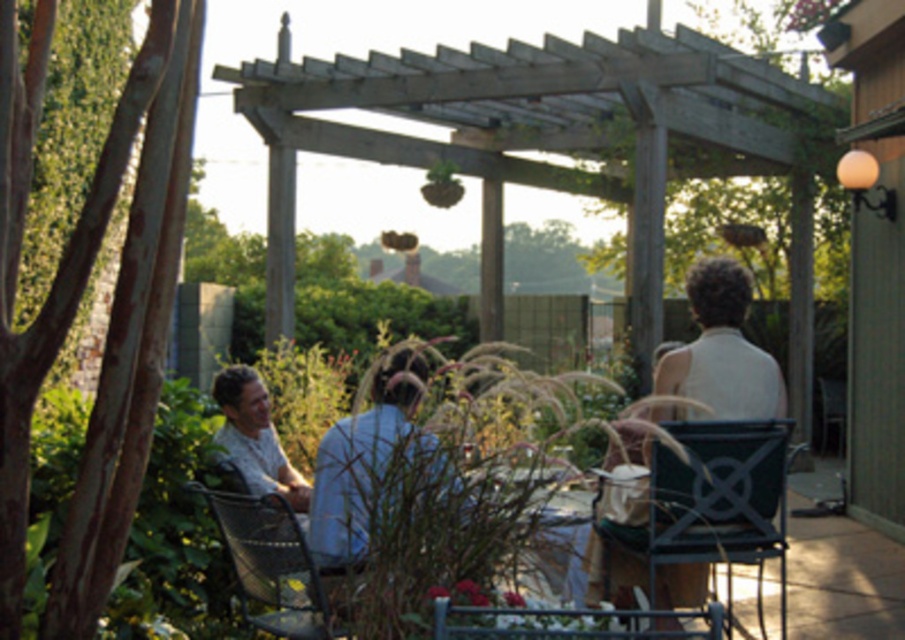
You are planning to seat guests at the patio and have both a metallic black chair at right and a metallic silver chair at lower left. Which chair would be more suitable for a guest who prefers a spacious seating option?

The metallic black chair at right is bigger than the metallic silver chair at lower left, so it would be more suitable for a guest who prefers a spacious seating option.

You are planning to host a small gathering and need to seat two guests. You have a metallic silver chair at lower left and a metallic silver chair at lower center available. Which chair would be more comfortable for taller guests?

The metallic silver chair at lower left is bigger than the metallic silver chair at lower center, so it would be more comfortable for taller guests.

What is the object at coordinate point (713, 499)?

The object at coordinate point (713, 499) is the metallic black chair at right.